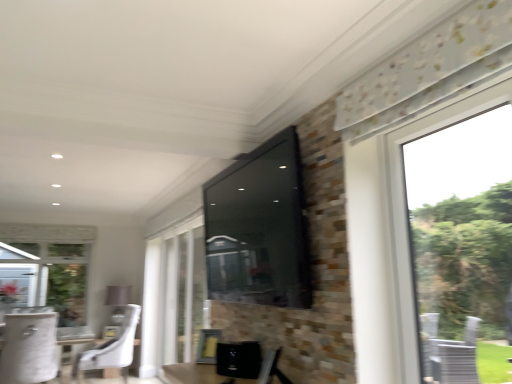
Question: Does white fabric round table at lower left appear on the right side of matte black tv at upper center?

Choices:
 (A) no
 (B) yes

Answer: (A)

Question: Does white fabric round table at lower left have a smaller size compared to matte black tv at upper center?

Choices:
 (A) no
 (B) yes

Answer: (B)

Question: Could you tell me if white fabric round table at lower left is turned towards matte black tv at upper center?

Choices:
 (A) no
 (B) yes

Answer: (B)

Question: Are white fabric round table at lower left and matte black tv at upper center far apart?

Choices:
 (A) yes
 (B) no

Answer: (A)

Question: From the image's perspective, does white fabric round table at lower left appear lower than matte black tv at upper center?

Choices:
 (A) no
 (B) yes

Answer: (B)

Question: Does white fabric round table at lower left lie behind matte black tv at upper center?

Choices:
 (A) no
 (B) yes

Answer: (B)

Question: Is white fabric chair at lower left, the first chair from the right, at the left side of transparent glass window at center?

Choices:
 (A) yes
 (B) no

Answer: (A)

Question: Is white fabric chair at lower left, the first chair from the right, closer to camera compared to transparent glass window at center?

Choices:
 (A) no
 (B) yes

Answer: (A)

Question: Does white fabric chair at lower left, the first chair from the right, turn towards transparent glass window at center?

Choices:
 (A) yes
 (B) no

Answer: (B)

Question: Does white fabric chair at lower left, the first chair from the right, have a lesser height compared to transparent glass window at center?

Choices:
 (A) yes
 (B) no

Answer: (A)

Question: Are white fabric chair at lower left, the first chair from the right, and transparent glass window at center far apart?

Choices:
 (A) yes
 (B) no

Answer: (B)

Question: Can you confirm if white fabric chair at lower left, the first chair from the right, is smaller than transparent glass window at center?

Choices:
 (A) yes
 (B) no

Answer: (B)

Question: Can you confirm if white fabric chair at lower left, arranged as the second chair when viewed from the left, is thinner than matte black tv at upper center?

Choices:
 (A) no
 (B) yes

Answer: (A)